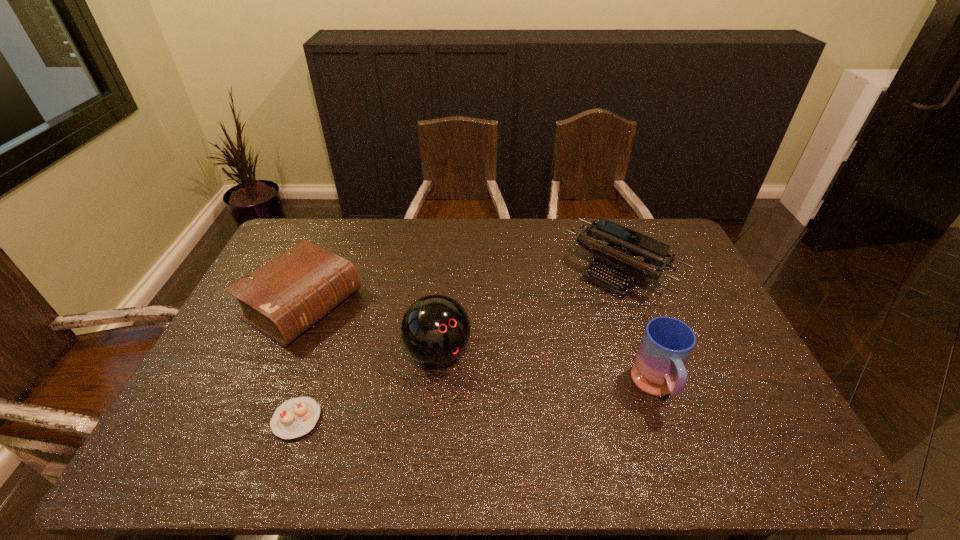
Locate an element on the screen. Image resolution: width=960 pixels, height=540 pixels. vacant spot on the desktop that is between the cupcake and the mug and is positioned on the spine side of the Bible is located at coordinates (468, 404).

In order to click on free space on the desktop that is between the shortest object and the mug and is positioned on the typing side of the typewriter in this screenshot , I will do `click(481, 403)`.

Find the location of `vacant spot on the desktop that is between the cupcake and the mug and is positioned on the surface of the bowling ball near the finger holes`. vacant spot on the desktop that is between the cupcake and the mug and is positioned on the surface of the bowling ball near the finger holes is located at coordinates (482, 402).